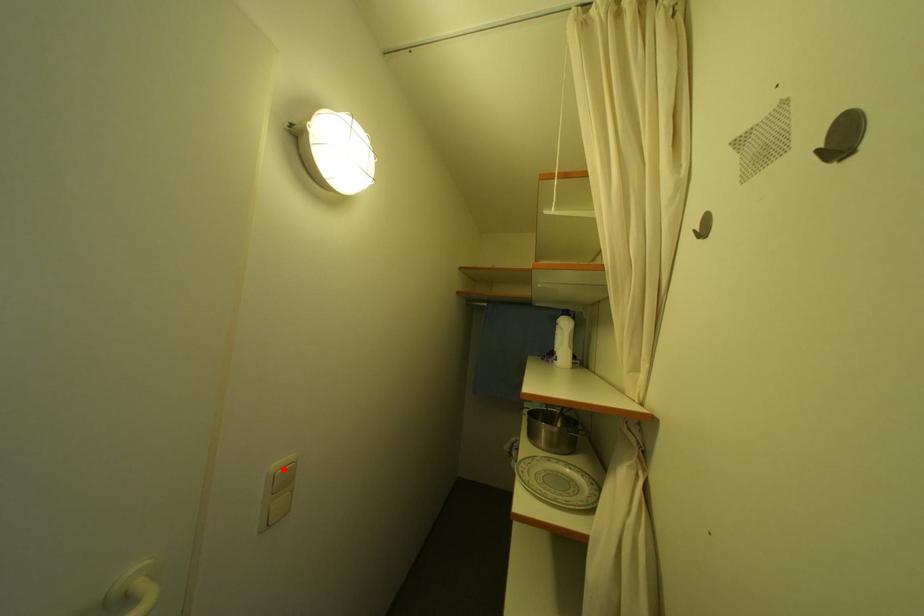
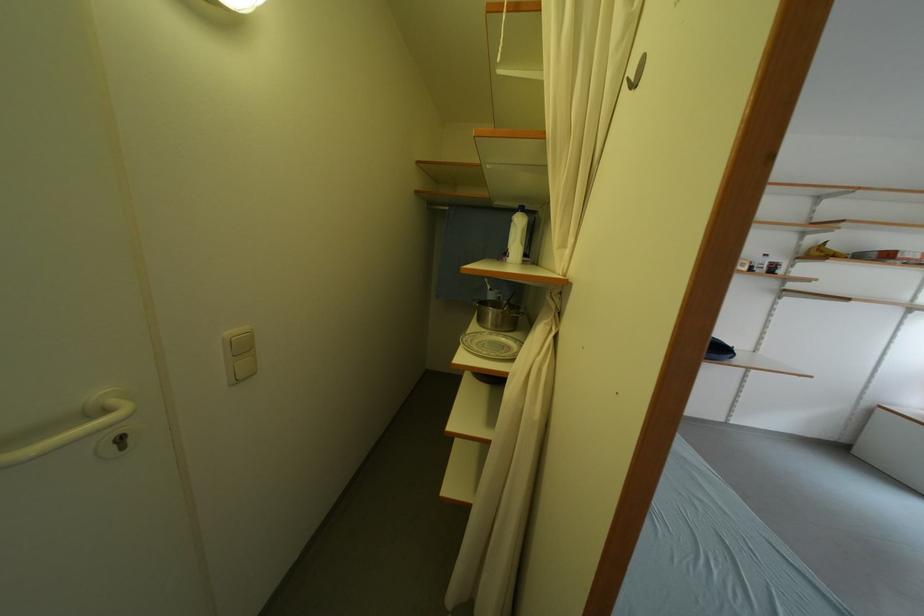
Locate, in the second image, the point that corresponds to the highlighted location in the first image.

(237, 336)